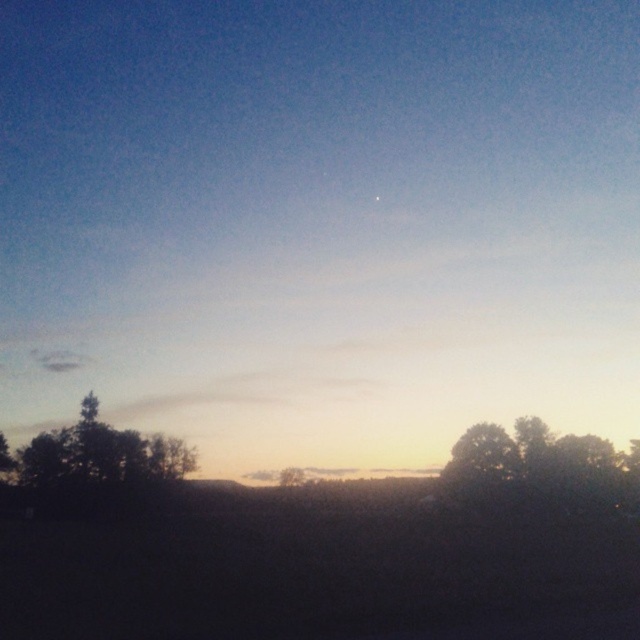
Question: Can you confirm if green leafy tree at lower right is smaller than green matte tree at center?

Choices:
 (A) yes
 (B) no

Answer: (A)

Question: Considering the relative positions of green leafy tree at lower right and green matte tree at center in the image provided, where is green leafy tree at lower right located with respect to green matte tree at center?

Choices:
 (A) below
 (B) above

Answer: (B)

Question: Which object appears closest to the camera in this image?

Choices:
 (A) green leafy tree at lower right
 (B) green matte tree at left

Answer: (B)

Question: Estimate the real-world distances between objects in this image. Which object is closer to the green leafy tree at lower right?

Choices:
 (A) green matte tree at center
 (B) green matte tree at left

Answer: (B)

Question: Is green leafy tree at lower right wider than green matte tree at left?

Choices:
 (A) yes
 (B) no

Answer: (A)

Question: Among these objects, which one is farthest from the camera?

Choices:
 (A) green matte tree at center
 (B) green leafy tree at lower right
 (C) green matte tree at left

Answer: (A)